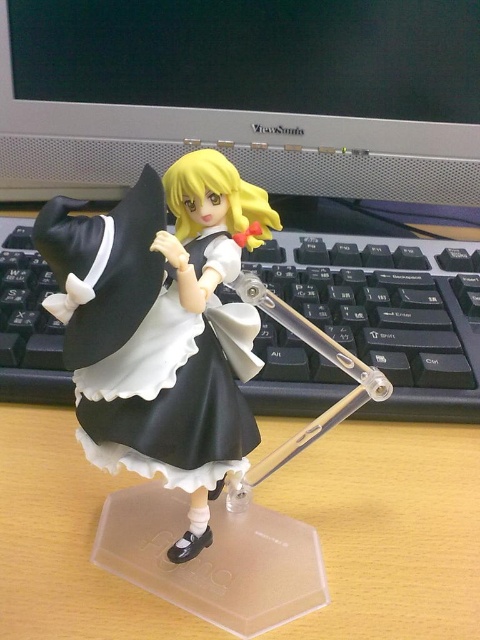
You are setting up a display on your desk and want to arrange the black matte maid outfit at center and the satin silver monitor at upper center. Based on their sizes, which object should you place first to ensure proper positioning?

The black matte maid outfit at center is smaller than the satin silver monitor at upper center, so you should place the satin silver monitor at upper center first as it requires more space.